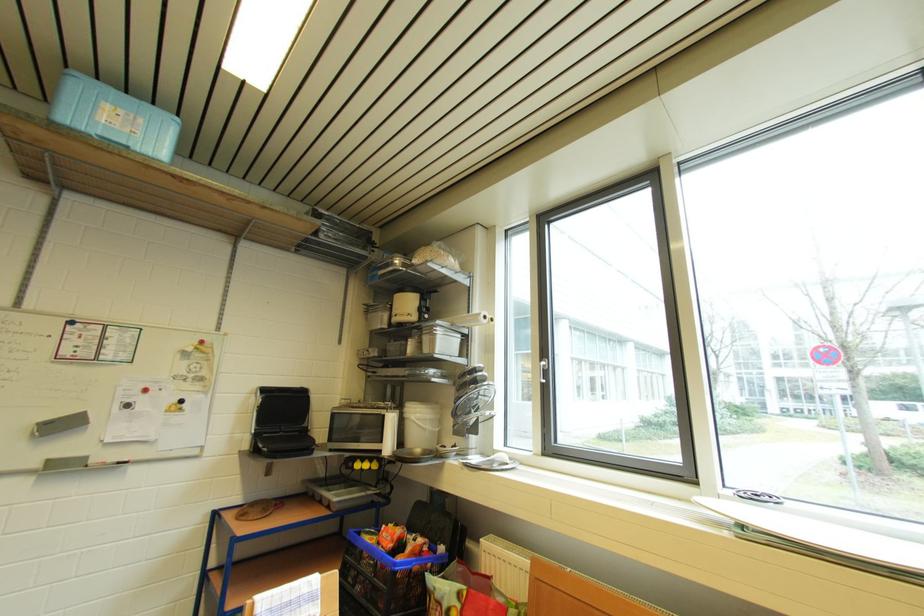
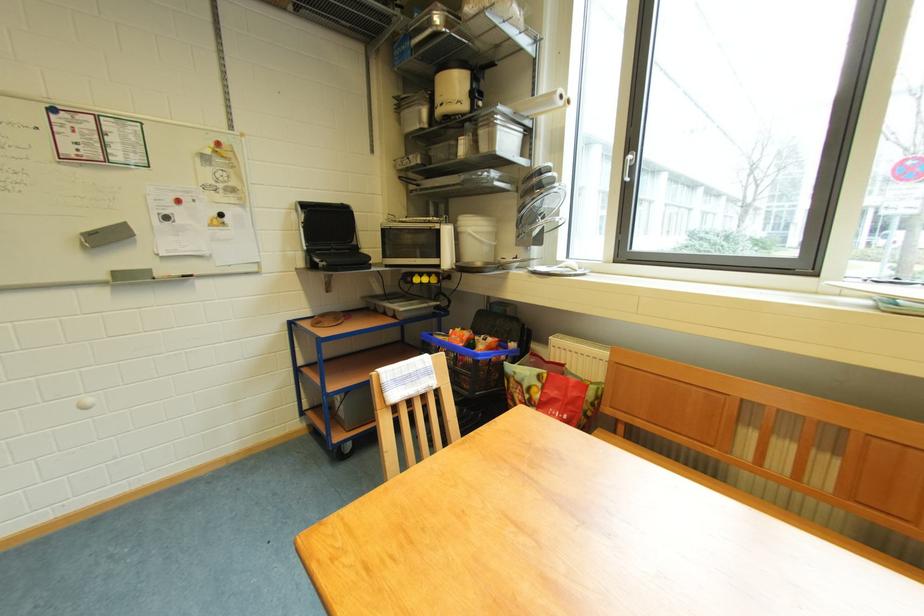
Find the pixel in the second image that matches (x=431, y=334) in the first image.

(488, 127)